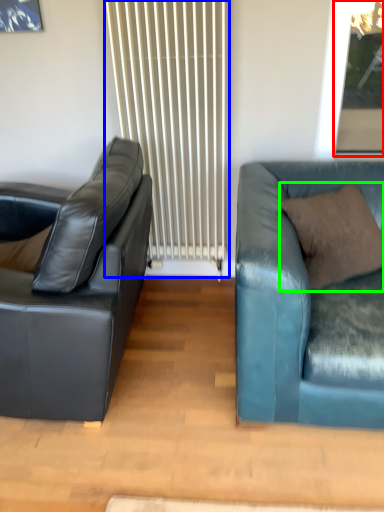
Question: Based on their relative distances, which object is nearer to window screen (highlighted by a red box)? Choose from radiator (highlighted by a blue box) and pillow (highlighted by a green box).

Choices:
 (A) radiator
 (B) pillow

Answer: (B)